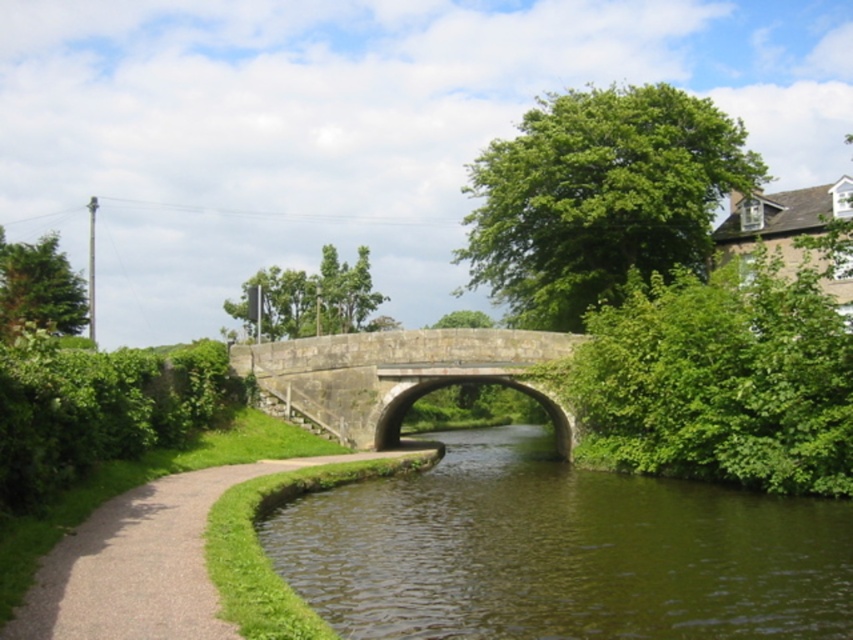
Does green smooth water at center appear on the left side of paved gravel path at lower left?

In fact, green smooth water at center is to the right of paved gravel path at lower left.

Is green smooth water at center positioned at the back of paved gravel path at lower left?

Yes, green smooth water at center is further from the viewer.

I want to click on green smooth water at center, so click(x=561, y=552).

Between paved gravel path at lower left and stone bridge at center, which one is positioned higher?

stone bridge at center is higher up.

Which of these two, paved gravel path at lower left or stone bridge at center, stands shorter?

Standing shorter between the two is paved gravel path at lower left.

Based on the photo, who is more forward, (136, 632) or (300, 365)?

Point (136, 632) is in front.

Identify the location of paved gravel path at lower left. This screenshot has width=853, height=640. (149, 561).

Is point (410, 492) in front of point (445, 356)?

Yes, it is.

How far apart are green smooth water at center and stone bridge at center?

43.70 feet

Where is `green smooth water at center`? The image size is (853, 640). green smooth water at center is located at coordinates (561, 552).